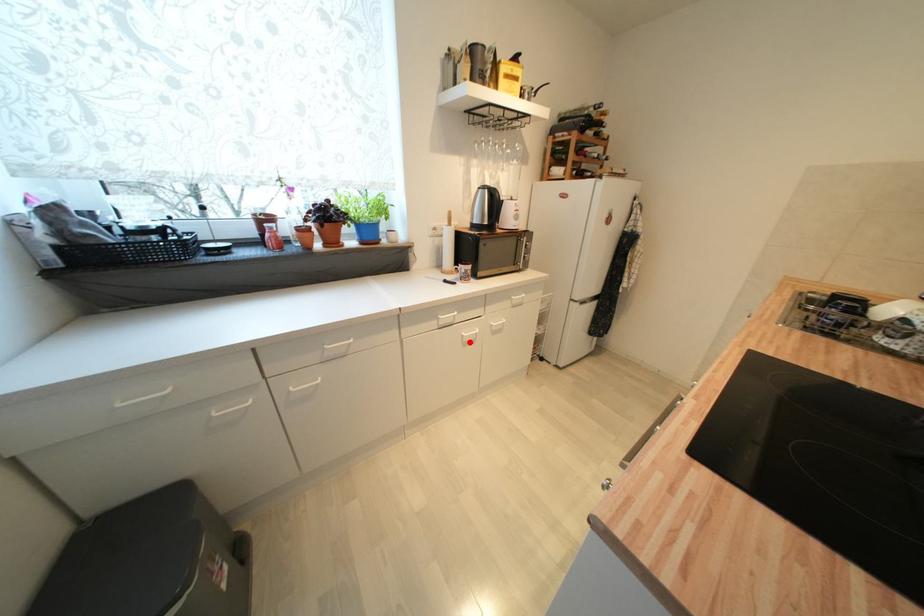
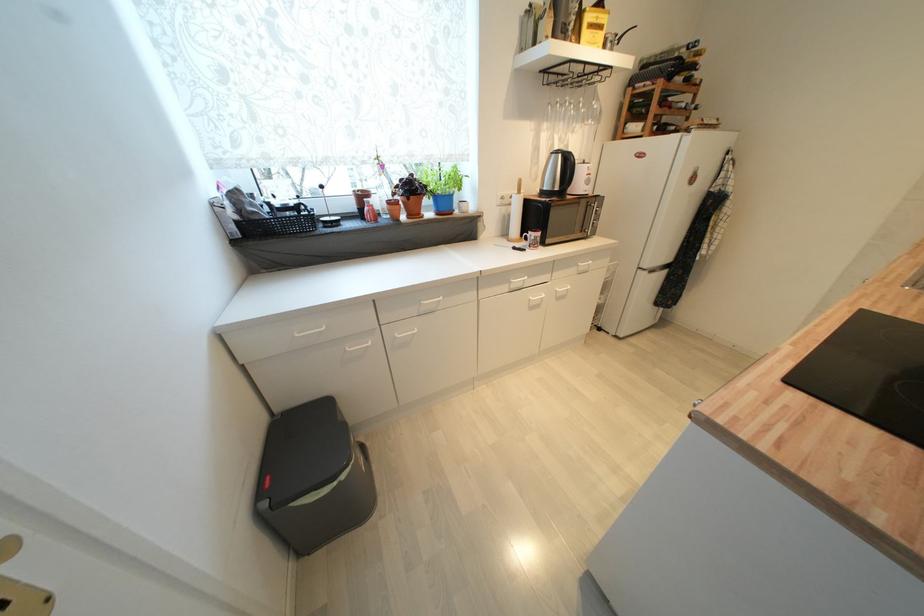
The point at the highlighted location is marked in the first image. Where is the corresponding point in the second image?

(536, 306)